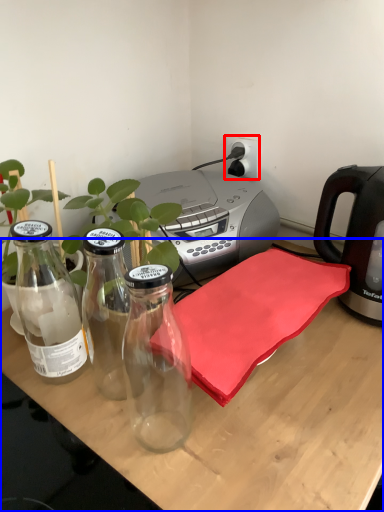
Question: Which of the following is the closest to the observer, electric outlet (highlighted by a red box) or desk (highlighted by a blue box)?

Choices:
 (A) electric outlet
 (B) desk

Answer: (B)